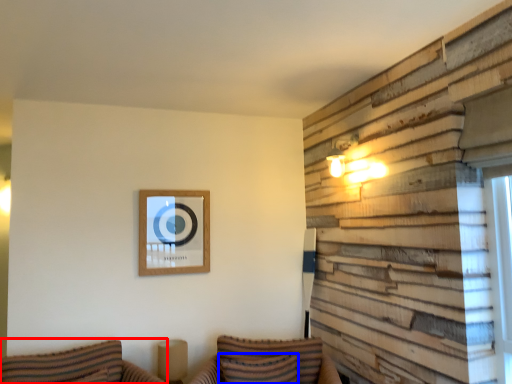
Question: Among these objects, which one is nearest to the camera, couch (highlighted by a red box) or pillow (highlighted by a blue box)?

Choices:
 (A) couch
 (B) pillow

Answer: (A)